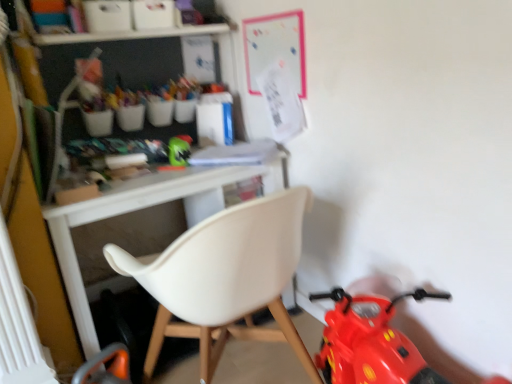
Question: From the image's perspective, is green matte helmet at center positioned above or below white plastic chair at center?

Choices:
 (A) above
 (B) below

Answer: (A)

Question: Based on their positions, is green matte helmet at center located to the left or right of white plastic chair at center?

Choices:
 (A) left
 (B) right

Answer: (A)

Question: Estimate the real-world distances between objects in this image. Which object is closer to the white plastic chair at center?

Choices:
 (A) green matte helmet at center
 (B) white plastic radiator at lower left

Answer: (B)

Question: Which of these objects is positioned closest to the green matte helmet at center?

Choices:
 (A) white plastic chair at center
 (B) white plastic radiator at lower left

Answer: (A)